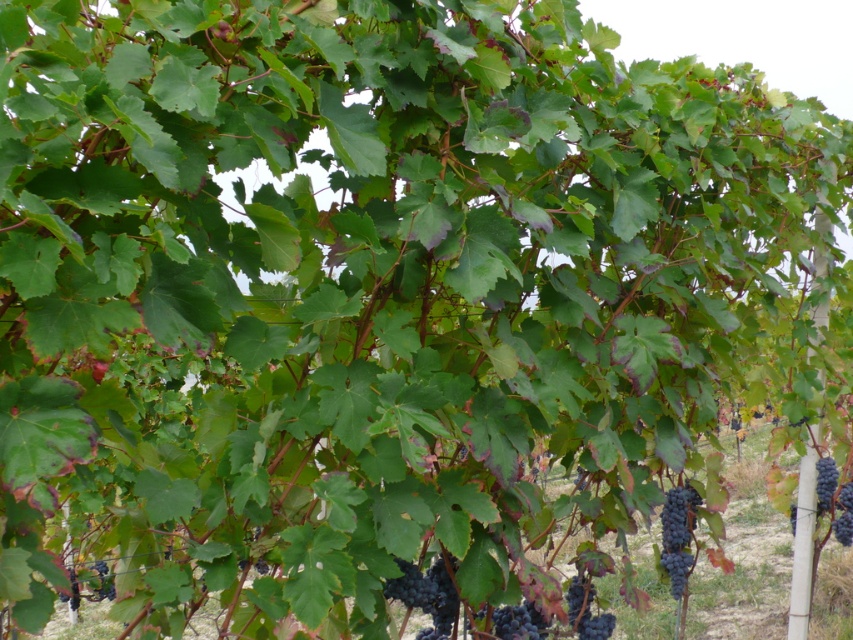
In order to click on dark purple grapes at right in this screenshot , I will do `click(834, 499)`.

Is point (793, 532) less distant than point (100, 580)?

Yes, it is in front of point (100, 580).

The height and width of the screenshot is (640, 853). Identify the location of dark purple grapes at right. (834, 499).

Does dark purple grapes at lower center have a smaller size compared to purple matte grape at lower left?

Yes.

Based on the photo, does dark purple grapes at lower center appear under purple matte grape at lower left?

Incorrect, dark purple grapes at lower center is not positioned below purple matte grape at lower left.

Where is `dark purple grapes at lower center`? The width and height of the screenshot is (853, 640). dark purple grapes at lower center is located at coordinates (585, 611).

Does dark purple grapes at center have a greater height compared to purple matte grape at lower left?

Incorrect, dark purple grapes at center's height is not larger of purple matte grape at lower left's.

Can you confirm if dark purple grapes at center is thinner than purple matte grape at lower left?

Correct, dark purple grapes at center's width is less than purple matte grape at lower left's.

Who is more forward, [421,598] or [77,588]?

Point [421,598] is in front.

The height and width of the screenshot is (640, 853). I want to click on dark purple grapes at center, so click(x=426, y=595).